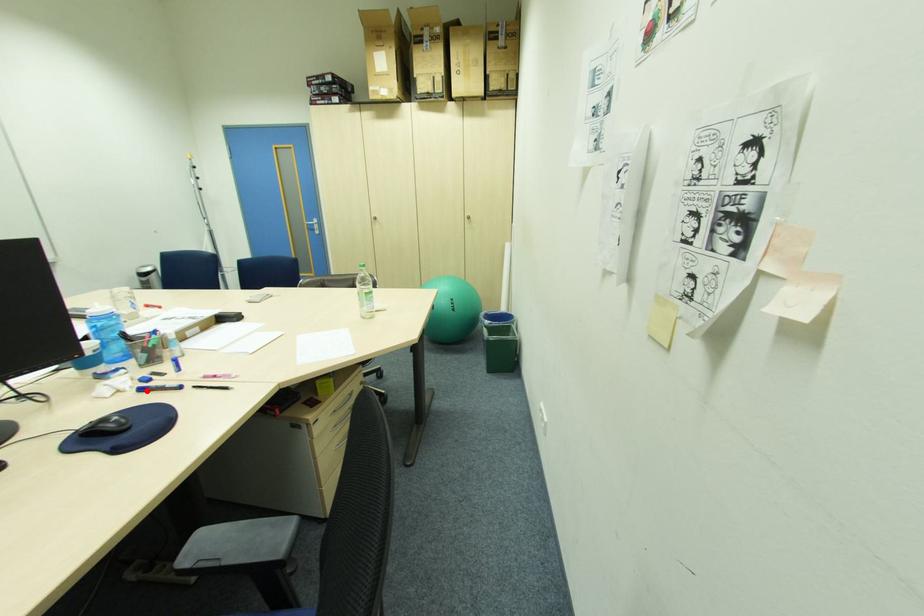
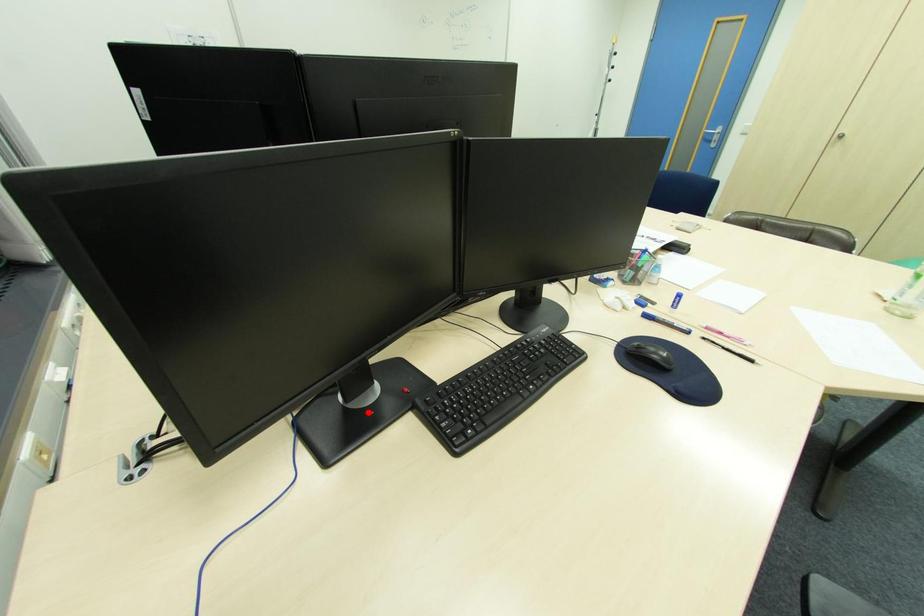
I am providing you with two images of the same scene from different viewpoints. A red point is marked on the first image and another point is marked on the second image. Does the point marked in image1 correspond to the same location as the one in image2?

No